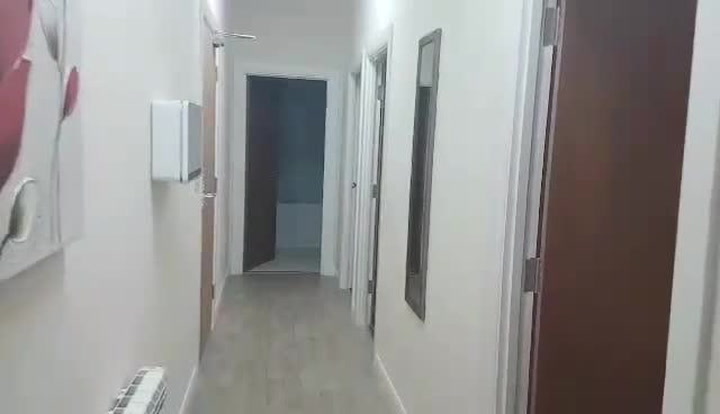
This screenshot has height=414, width=720. I want to click on painting, so click(x=32, y=131).